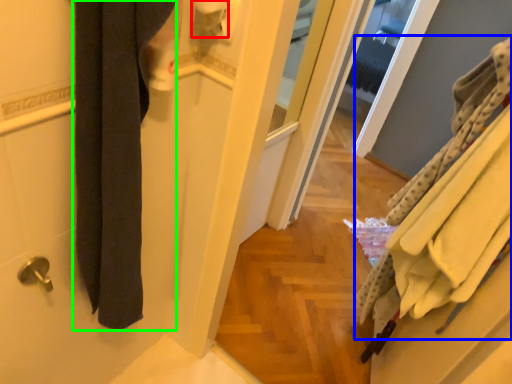
Question: Which object is the closest to the toilet paper (highlighted by a red box)? Choose among these: bath towel (highlighted by a blue box) or bath towel (highlighted by a green box).

Choices:
 (A) bath towel
 (B) bath towel

Answer: (B)